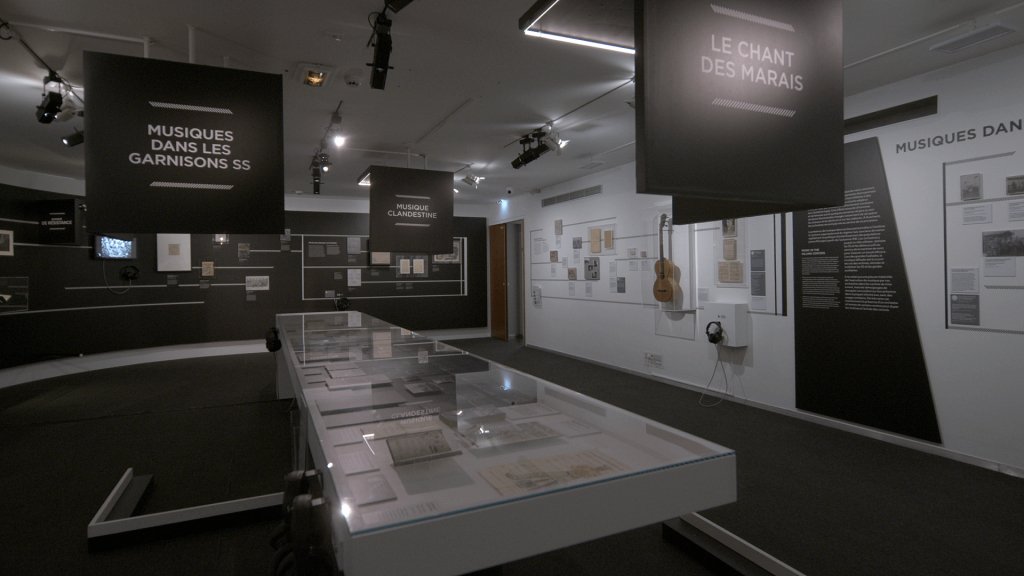
Where is `door`? The width and height of the screenshot is (1024, 576). door is located at coordinates (495, 286).